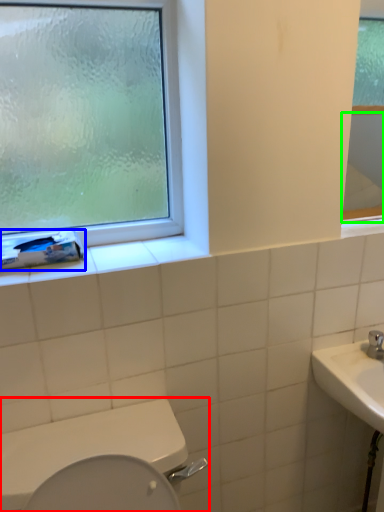
Question: Which object is the closest to the toilet (highlighted by a red box)? Choose among these: toilet paper (highlighted by a blue box) or mirror (highlighted by a green box).

Choices:
 (A) toilet paper
 (B) mirror

Answer: (A)